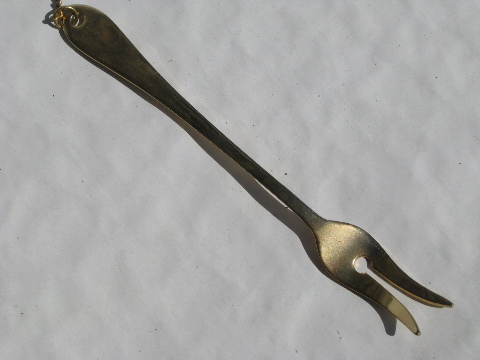
The height and width of the screenshot is (360, 480). What are the coordinates of `surface` in the screenshot? It's located at (257, 44).